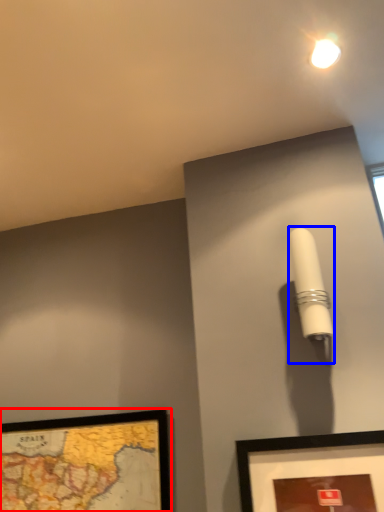
Question: Among these objects, which one is farthest to the camera, picture frame (highlighted by a red box) or table lamp (highlighted by a blue box)?

Choices:
 (A) picture frame
 (B) table lamp

Answer: (A)